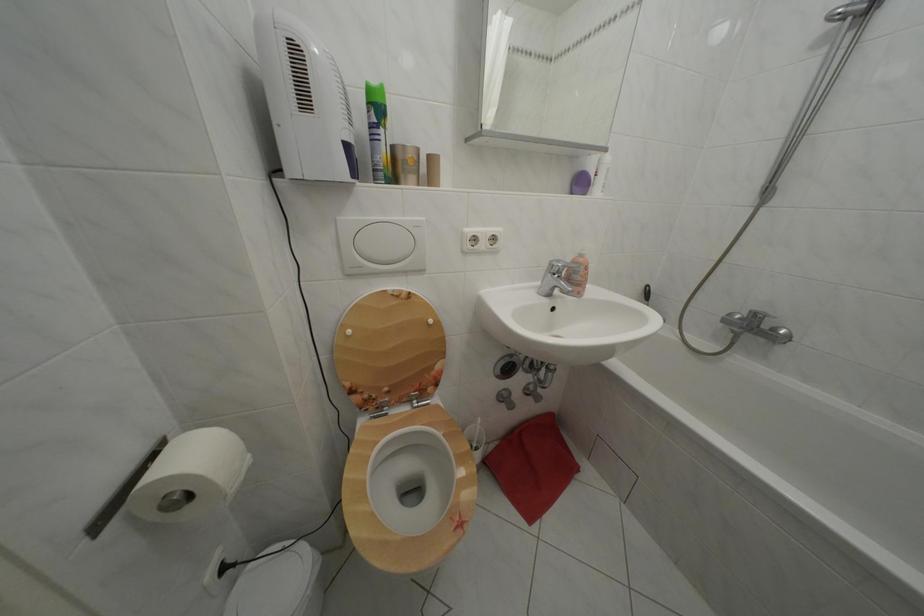
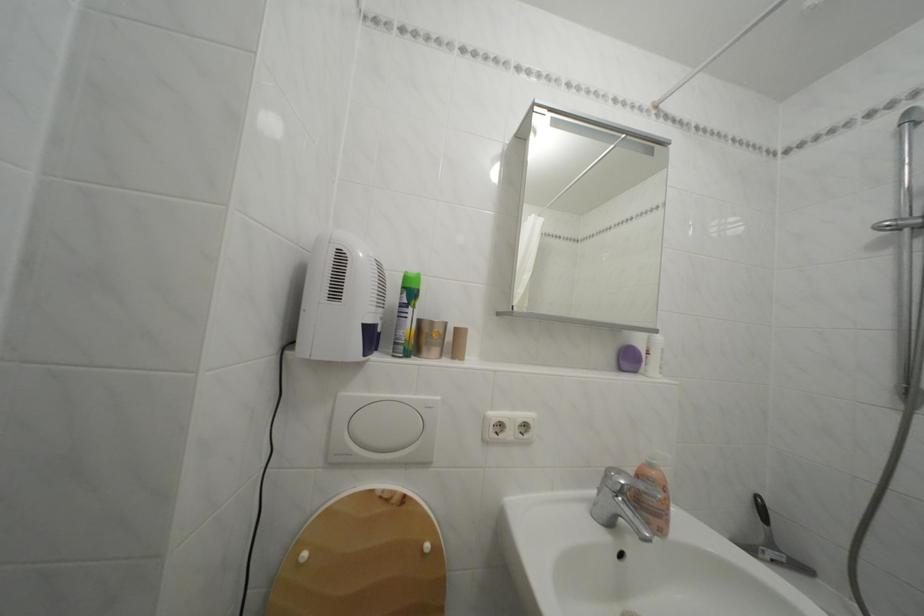
Question: The images are taken continuously from a first-person perspective. In which direction is your viewpoint rotating?

Choices:
 (A) Left
 (B) Right
 (C) Up
 (D) Down

Answer: (C)